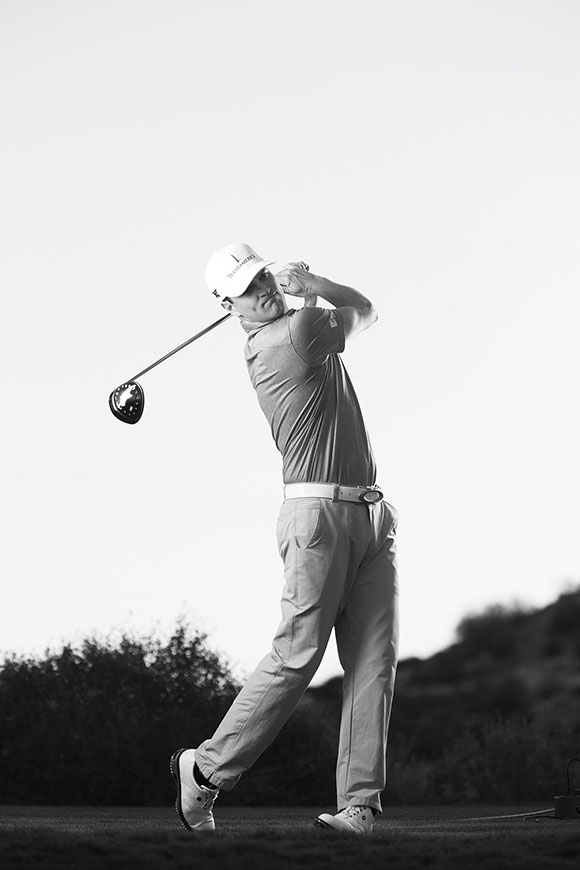
You are a GUI agent. You are given a task and a screenshot of the screen. Output one action in this format:
    pyautogui.click(x=<x>, y=<y>)
    Task: Click on the sock
    Image resolution: width=580 pixels, height=870 pixels.
    Given the screenshot: What is the action you would take?
    pyautogui.click(x=197, y=772)